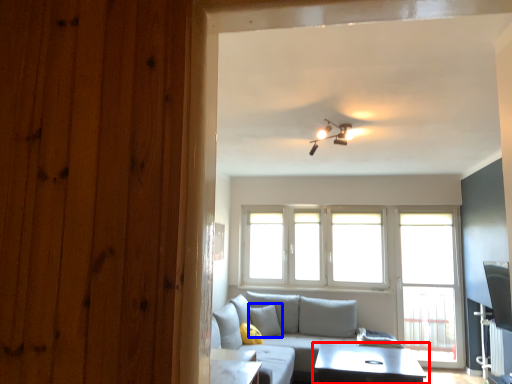
Question: Which point is closer to the camera, table (highlighted by a red box) or pillow (highlighted by a blue box)?

Choices:
 (A) table
 (B) pillow

Answer: (A)